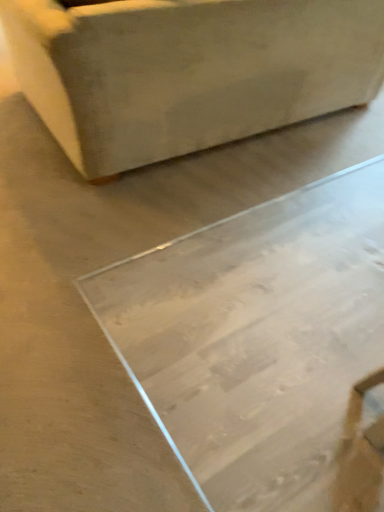
In order to face matte beige ottoman at upper left, should I rotate leftwards or rightwards?

To face it directly, rotate left by 0.772 degrees.

What is the approximate width of matte beige ottoman at upper left?

5.38 feet.

Measure the distance between point (x=272, y=106) and camera.

Point (x=272, y=106) is 2.12 meters away from camera.

Where is `matte beige ottoman at upper left`? Image resolution: width=384 pixels, height=512 pixels. matte beige ottoman at upper left is located at coordinates point(188,71).

What do you see at coordinates (188, 71) in the screenshot? I see `matte beige ottoman at upper left` at bounding box center [188, 71].

Where is `transparent glass table at center`? transparent glass table at center is located at coordinates (263, 346).

What do you see at coordinates (263, 346) in the screenshot? I see `transparent glass table at center` at bounding box center [263, 346].

You are a GUI agent. You are given a task and a screenshot of the screen. Output one action in this format:
    pyautogui.click(x=<x>, y=<y>)
    Task: Click on the matte beige ottoman at upper left
    The height and width of the screenshot is (512, 384).
    Given the screenshot: What is the action you would take?
    pyautogui.click(x=188, y=71)

Is matte beige ottoman at upper left to the left of transparent glass table at center from the viewer's perspective?

Indeed, matte beige ottoman at upper left is positioned on the left side of transparent glass table at center.

Is the position of matte beige ottoman at upper left more distant than that of transparent glass table at center?

Yes.

Which point is more distant from viewer, (63, 95) or (342, 422)?

Positioned behind is point (63, 95).

From the image's perspective, who appears lower, matte beige ottoman at upper left or transparent glass table at center?

transparent glass table at center.

From a real-world perspective, which is physically above, matte beige ottoman at upper left or transparent glass table at center?

matte beige ottoman at upper left.

Looking at their sizes, would you say matte beige ottoman at upper left is wider or thinner than transparent glass table at center?

matte beige ottoman at upper left is thinner than transparent glass table at center.

Does matte beige ottoman at upper left have a greater height compared to transparent glass table at center?

Yes.

Which of these two, matte beige ottoman at upper left or transparent glass table at center, is bigger?

With larger size is matte beige ottoman at upper left.

Consider the image. Is matte beige ottoman at upper left not inside transparent glass table at center?

Absolutely, matte beige ottoman at upper left is external to transparent glass table at center.

Is matte beige ottoman at upper left next to transparent glass table at center and touching it?

No, matte beige ottoman at upper left is not with transparent glass table at center.

Does matte beige ottoman at upper left turn towards transparent glass table at center?

No, matte beige ottoman at upper left is not turned towards transparent glass table at center.

In the scene shown: What's the angular difference between matte beige ottoman at upper left and transparent glass table at center's facing directions?

They differ by 0.0803 degrees in their facing directions.

How much distance is there between matte beige ottoman at upper left and transparent glass table at center?

The distance of matte beige ottoman at upper left from transparent glass table at center is 85.61 centimeters.

Identify the location of table to the right of matte beige ottoman at upper left. (263, 346).

Visually, is transparent glass table at center positioned to the left or to the right of matte beige ottoman at upper left?

transparent glass table at center is positioned on matte beige ottoman at upper left's right side.

Is the position of transparent glass table at center more distant than that of matte beige ottoman at upper left?

No, transparent glass table at center is in front of matte beige ottoman at upper left.

Which point is more distant from viewer, (376, 241) or (345, 90)?

The point (345, 90) is farther from the camera.

From the image's perspective, which one is positioned higher, transparent glass table at center or matte beige ottoman at upper left?

matte beige ottoman at upper left.

In the scene shown: From a real-world perspective, is transparent glass table at center physically above matte beige ottoman at upper left?

No, from a real-world perspective, transparent glass table at center is not above matte beige ottoman at upper left.

Does transparent glass table at center have a lesser width compared to matte beige ottoman at upper left?

In fact, transparent glass table at center might be wider than matte beige ottoman at upper left.

Does transparent glass table at center have a greater height compared to matte beige ottoman at upper left?

Incorrect, the height of transparent glass table at center is not larger of that of matte beige ottoman at upper left.

Looking at the image, does transparent glass table at center seem bigger or smaller compared to matte beige ottoman at upper left?

transparent glass table at center is smaller than matte beige ottoman at upper left.

Which is correct: transparent glass table at center is inside matte beige ottoman at upper left, or outside of it?

transparent glass table at center is spatially situated outside matte beige ottoman at upper left.

Is transparent glass table at center placed right next to matte beige ottoman at upper left?

No, transparent glass table at center is not touching matte beige ottoman at upper left.

Is transparent glass table at center positioned with its back to matte beige ottoman at upper left?

No, matte beige ottoman at upper left is not at the back of transparent glass table at center.

How different are the orientations of transparent glass table at center and matte beige ottoman at upper left in degrees?

There is a 0.0803-degree angle between the facing directions of transparent glass table at center and matte beige ottoman at upper left.

You are a GUI agent. You are given a task and a screenshot of the screen. Output one action in this format:
    pyautogui.click(x=<x>, y=<y>)
    Task: Click on the table that is below the matte beige ottoman at upper left (from the image's perspective)
    Image resolution: width=384 pixels, height=512 pixels.
    Given the screenshot: What is the action you would take?
    pyautogui.click(x=263, y=346)

I want to click on furniture behind the transparent glass table at center, so click(188, 71).

In order to click on table on the right of matte beige ottoman at upper left in this screenshot , I will do `click(263, 346)`.